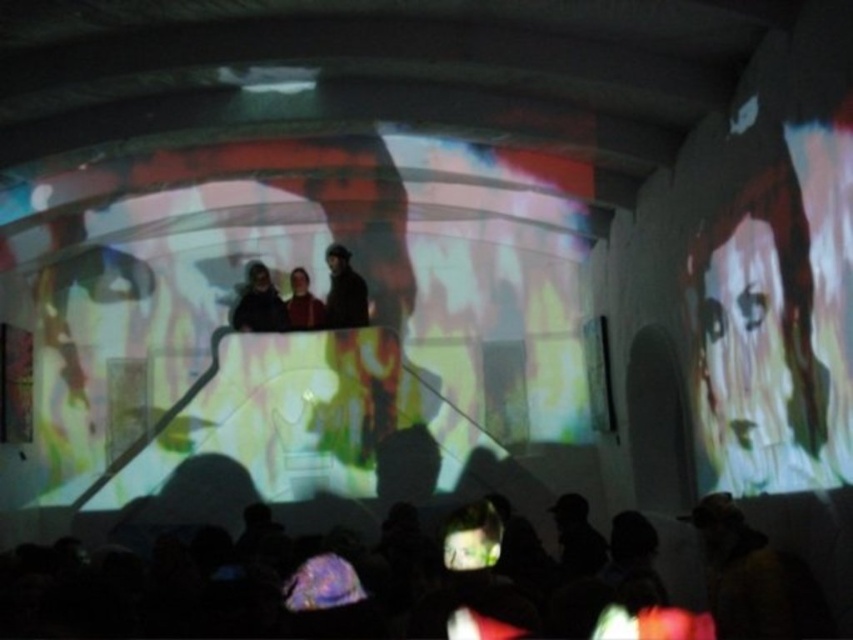
In the scene shown: Who is shorter, translucent fabric screen at center or silhouette crowd at lower center?

Standing shorter between the two is translucent fabric screen at center.

Can you confirm if translucent fabric screen at center is shorter than silhouette crowd at lower center?

Yes.

Identify the location of translucent fabric screen at center. This screenshot has width=853, height=640. (299, 332).

Is matte black jacket at center closer to camera compared to matte red shirt at center?

Yes, it is.

Can you confirm if matte black jacket at center is wider than matte red shirt at center?

Correct, the width of matte black jacket at center exceeds that of matte red shirt at center.

Between point (248, 278) and point (302, 310), which one is positioned in front?

Point (302, 310) is in front.

You are a GUI agent. You are given a task and a screenshot of the screen. Output one action in this format:
    pyautogui.click(x=<x>, y=<y>)
    Task: Click on the matte black jacket at center
    
    Given the screenshot: What is the action you would take?
    pyautogui.click(x=259, y=304)

Does translucent fabric screen at center have a lesser width compared to matte red shirt at center?

Indeed, translucent fabric screen at center has a lesser width compared to matte red shirt at center.

Between translucent fabric screen at center and matte red shirt at center, which one is positioned higher?

translucent fabric screen at center is higher up.

This screenshot has height=640, width=853. What do you see at coordinates (299, 332) in the screenshot?
I see `translucent fabric screen at center` at bounding box center [299, 332].

Locate an element on the screen. This screenshot has width=853, height=640. translucent fabric screen at center is located at coordinates (299, 332).